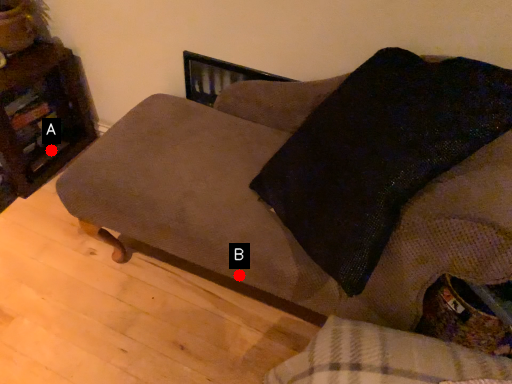
Question: Two points are circled on the image, labeled by A and B beside each circle. Which of the following is the closest to the observer?

Choices:
 (A) A is closer
 (B) B is closer

Answer: (B)